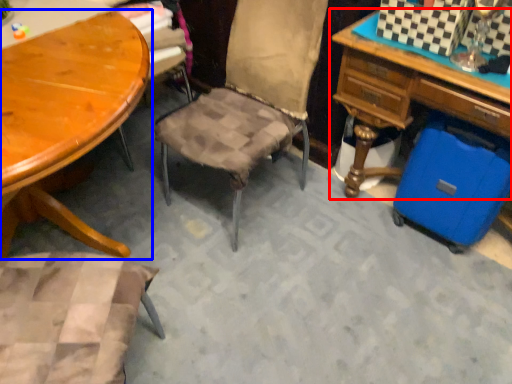
Question: Which object appears farthest to the camera in this image, desk (highlighted by a red box) or table (highlighted by a blue box)?

Choices:
 (A) desk
 (B) table

Answer: (A)